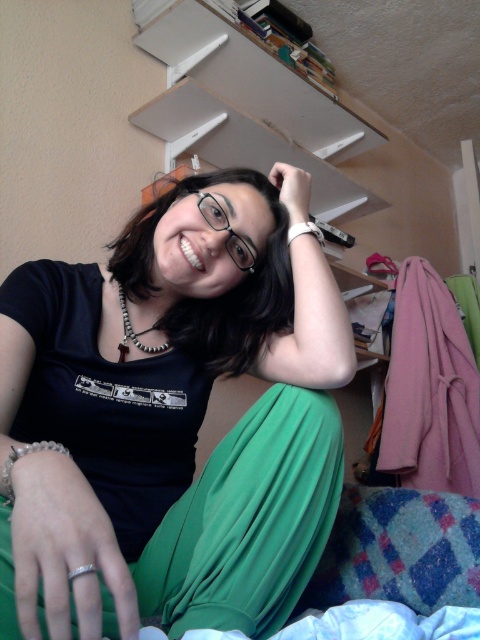
Can you confirm if silver beaded bracelet at wrist is smaller than white leather bracelet at upper center?

No.

Identify the location of silver beaded bracelet at wrist. (22, 456).

Where is `silver beaded bracelet at wrist`? silver beaded bracelet at wrist is located at coordinates (22, 456).

Does silver beaded bracelet at wrist appear over white beaded necklace at center?

No, silver beaded bracelet at wrist is not above white beaded necklace at center.

Does point (51, 442) lie in front of point (137, 342)?

Yes, point (51, 442) is closer to viewer.

Does point (17, 448) come closer to viewer compared to point (121, 339)?

Yes, it is in front of point (121, 339).

Locate an element on the screen. Image resolution: width=480 pixels, height=640 pixels. silver beaded bracelet at wrist is located at coordinates (22, 456).

Between white matte bookshelf at upper center and white leather bracelet at upper center, which one is positioned lower?

white leather bracelet at upper center

Image resolution: width=480 pixels, height=640 pixels. Find the location of `white matte bookshelf at upper center`. white matte bookshelf at upper center is located at coordinates (248, 108).

Find the location of `white matte bookshelf at upper center`. white matte bookshelf at upper center is located at coordinates (248, 108).